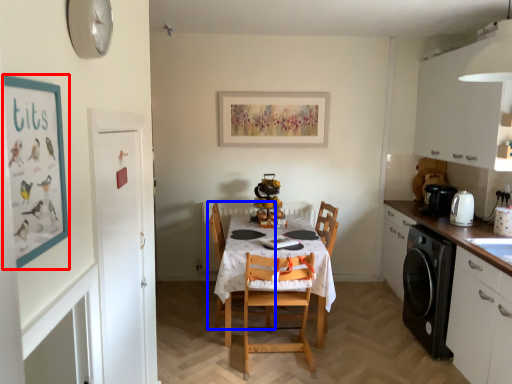
Question: Among these objects, which one is nearest to the camera, bulletin board (highlighted by a red box) or chair (highlighted by a blue box)?

Choices:
 (A) bulletin board
 (B) chair

Answer: (A)